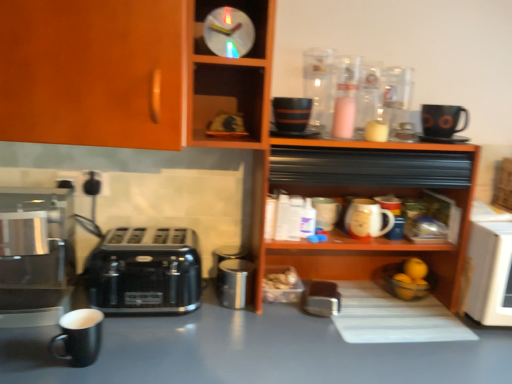
At what (x,y) coordinates should I click in order to perform the action: click on free space between black plastic toaster at lower left and black matte mug at lower left. Please return your answer as a coordinate pair (x, y). This screenshot has width=512, height=384. Looking at the image, I should click on (138, 337).